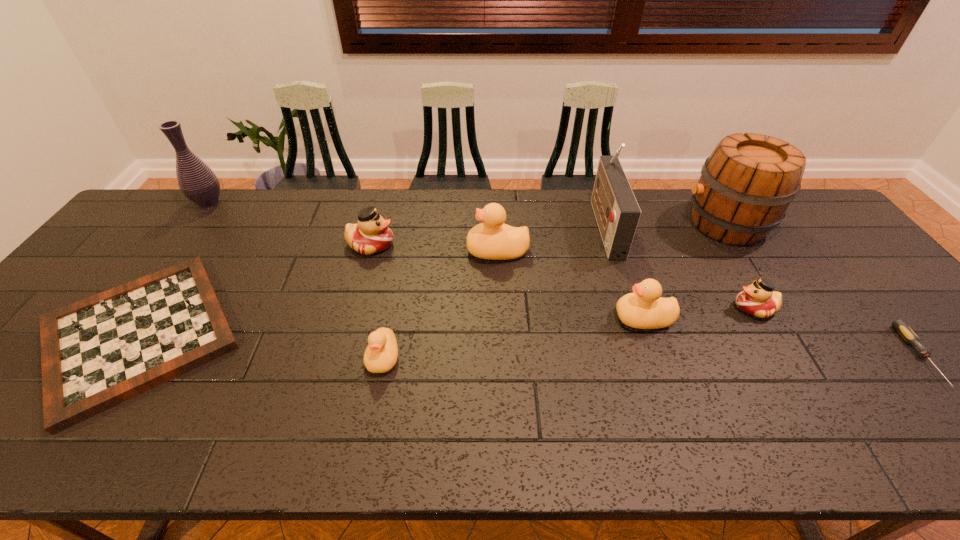
Where is `the fifth closest object to the farther red duck`? the fifth closest object to the farther red duck is located at coordinates (617, 213).

Where is `object that stands as the fifth closest to the second biggest yellow duck`? object that stands as the fifth closest to the second biggest yellow duck is located at coordinates (380, 356).

Identify the location of duck object that ranks as the third closest to the radio receiver. The image size is (960, 540). (758, 299).

Where is `duck that can be found as the second closest to the second farthest yellow duck`? duck that can be found as the second closest to the second farthest yellow duck is located at coordinates (x=492, y=239).

The height and width of the screenshot is (540, 960). I want to click on the third closest yellow duck to the vase, so click(x=645, y=308).

Identify the location of the second closest yellow duck to the second shortest object. (492, 239).

This screenshot has height=540, width=960. Find the location of `vacant region that satisfies the following two spatial constraints: 1. on the face of the second farthest yellow duck; 2. on the face of the smallest yellow duck`. vacant region that satisfies the following two spatial constraints: 1. on the face of the second farthest yellow duck; 2. on the face of the smallest yellow duck is located at coordinates (657, 357).